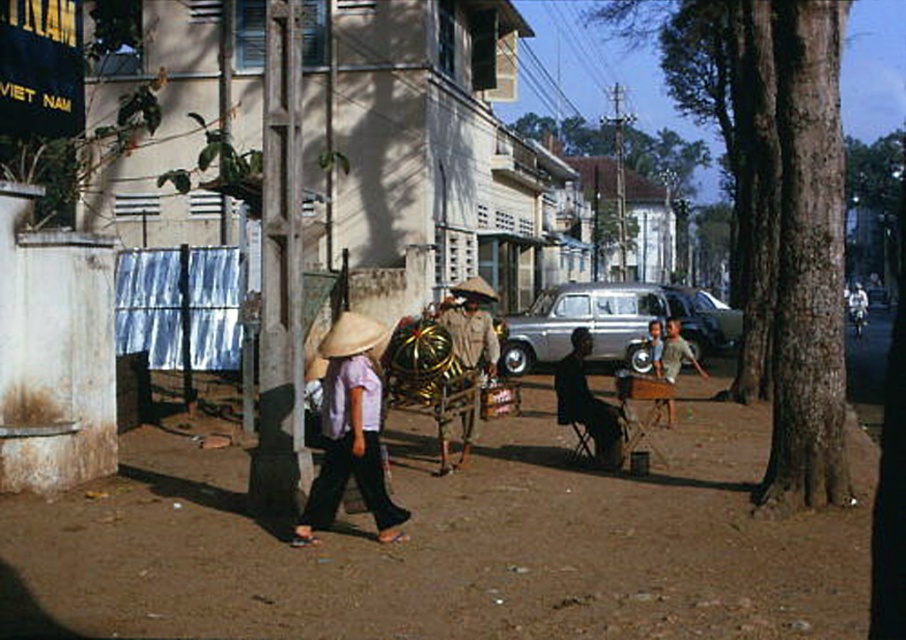
You are a farmer in the scene who needs to decide where to plant seeds. Given the brown dirt field at center and the natural straw hat at center, which area is more suitable for planting crops?

The brown dirt field at center is more suitable for planting crops because it has a larger size compared to the natural straw hat at center.

You are a delivery driver who needs to drive a truck that is 2 meters wide through the street shown in the image. The truck must pass between the brown dirt field at center and the silver metallic van at center. Can your truck fit through the space between them?

The brown dirt field at center is wider than the silver metallic van at center, but the exact width of the space between them isn